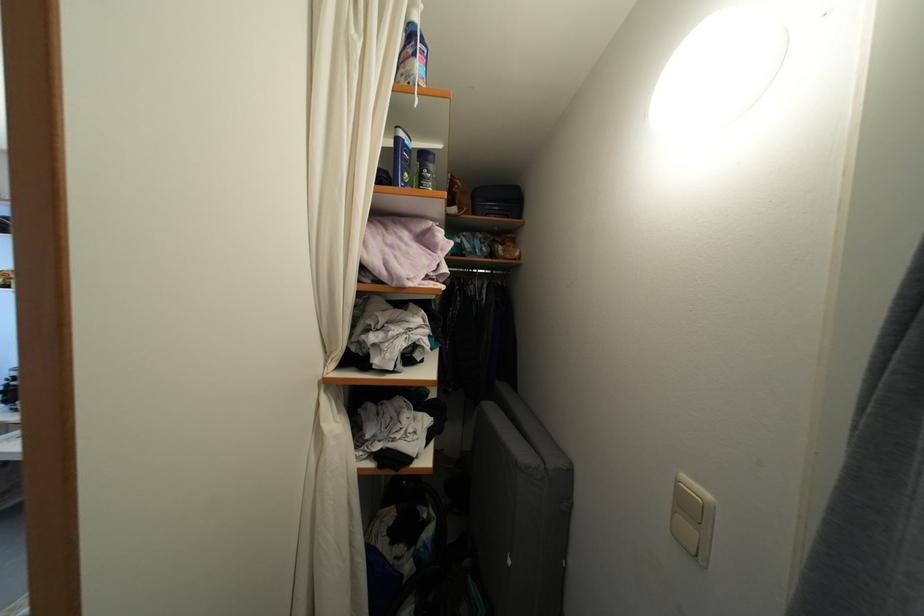
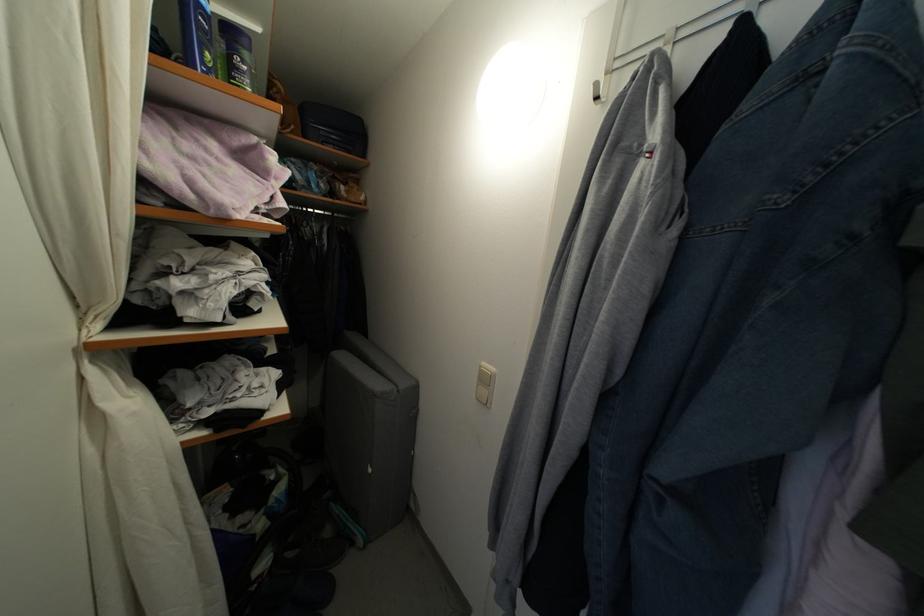
Where in the second image is the point corresponding to (436,172) from the first image?

(251, 61)